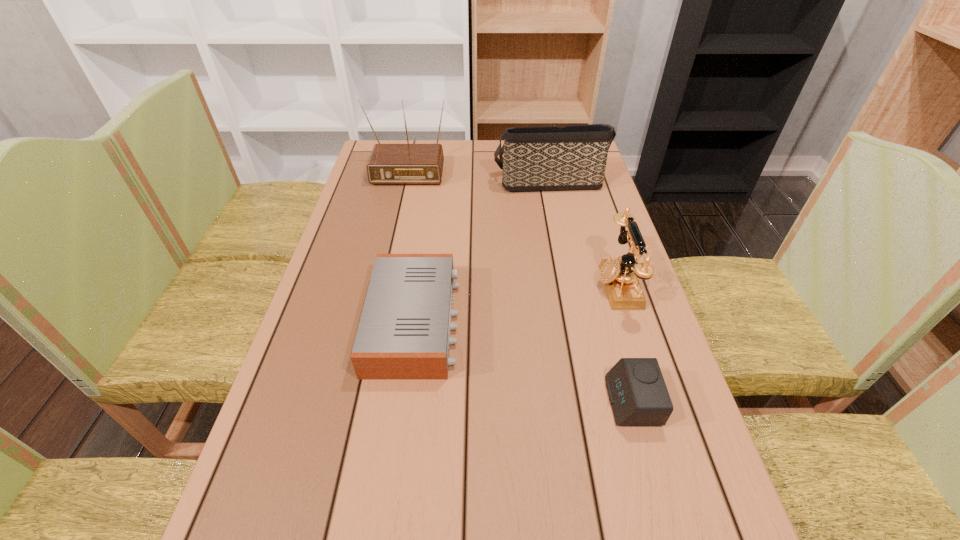
The height and width of the screenshot is (540, 960). What are the coordinates of `the farther radio receiver` in the screenshot? It's located at (407, 163).

The height and width of the screenshot is (540, 960). In order to click on handbag in this screenshot , I will do `click(541, 158)`.

The image size is (960, 540). I want to click on telephone, so click(x=621, y=277).

Find the location of `the nearer radio receiver`. the nearer radio receiver is located at coordinates (404, 331).

You are a GUI agent. You are given a task and a screenshot of the screen. Output one action in this format:
    pyautogui.click(x=<x>, y=<y>)
    Task: Click on the alarm clock
    The width and height of the screenshot is (960, 540).
    Given the screenshot: What is the action you would take?
    pyautogui.click(x=637, y=392)

You are a GUI agent. You are given a task and a screenshot of the screen. Output one action in this format:
    pyautogui.click(x=<x>, y=<y>)
    Task: Click on the vacant space located 0.360m on the front panel of the farther radio receiver
    This screenshot has height=540, width=960.
    Given the screenshot: What is the action you would take?
    pyautogui.click(x=387, y=261)

Where is `vacant region located 0.370m on the front of the handbag`? The width and height of the screenshot is (960, 540). vacant region located 0.370m on the front of the handbag is located at coordinates (567, 275).

Locate an element on the screen. The image size is (960, 540). vacant space located 0.230m on the dial of the telephone is located at coordinates 505,285.

Identify the location of blank space located 0.220m on the dial of the telephone. (509, 285).

I want to click on free space located 0.360m on the dial of the telephone, so click(453, 285).